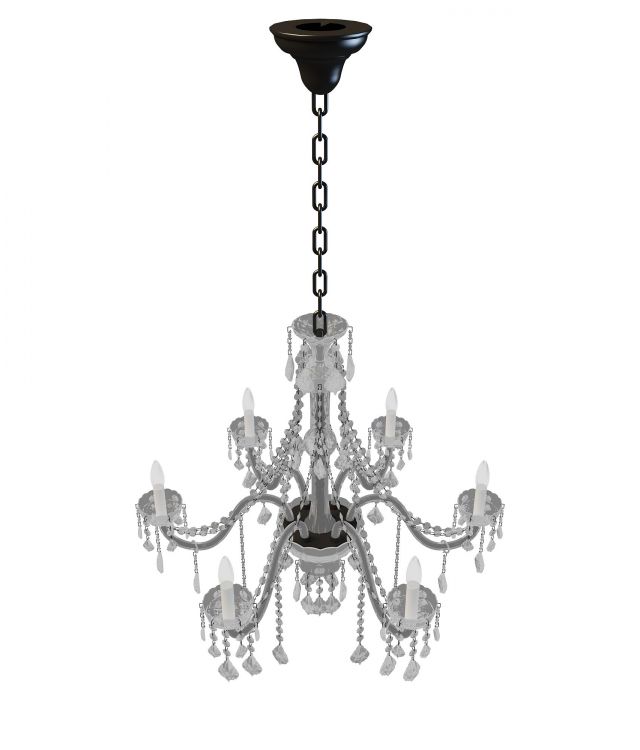
You are a GUI agent. You are given a task and a screenshot of the screen. Output one action in this format:
    pyautogui.click(x=<x>, y=<y>)
    Task: Click on the arms of chandelier
    
    Given the screenshot: What is the action you would take?
    pyautogui.click(x=240, y=505), pyautogui.click(x=274, y=483), pyautogui.click(x=275, y=565), pyautogui.click(x=351, y=531), pyautogui.click(x=370, y=496), pyautogui.click(x=342, y=472)